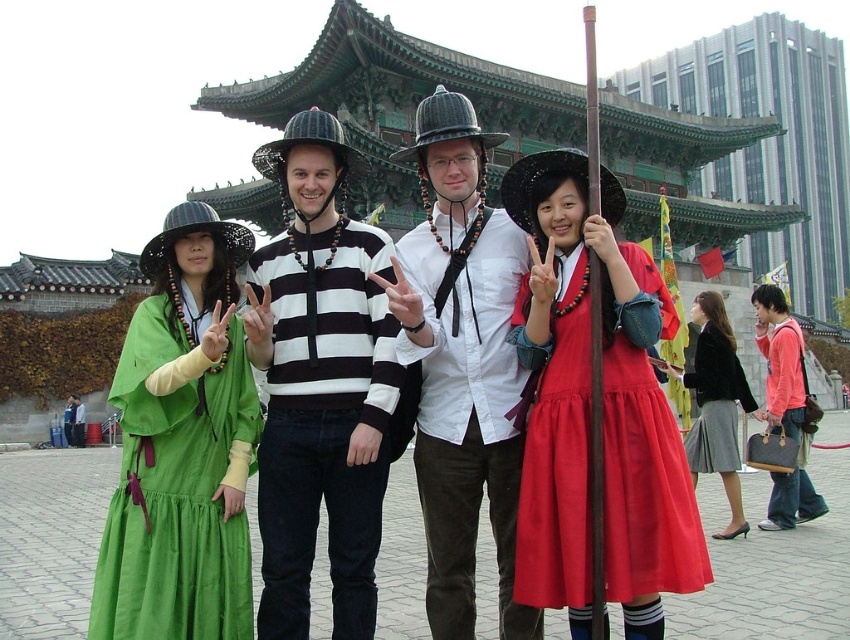
Question: Does gray pleated skirt at lower right appear on the right side of matte black dress at center?

Choices:
 (A) no
 (B) yes

Answer: (A)

Question: Which is nearer to the white striped sweater at center?

Choices:
 (A) green cotton dress at left
 (B) gray pleated skirt at lower right

Answer: (A)

Question: In this image, where is matte red dress at center located relative to gray pleated skirt at lower right?

Choices:
 (A) above
 (B) below

Answer: (A)

Question: Can you confirm if white striped sweater at center is positioned above matte black dress at center?

Choices:
 (A) yes
 (B) no

Answer: (A)

Question: Among these points, which one is farthest from the camera?

Choices:
 (A) (790, 390)
 (B) (633, 570)
 (C) (663, 364)
 (D) (238, 627)

Answer: (C)

Question: Which of the following is the farthest from the observer?

Choices:
 (A) pink fabric jacket at right
 (B) white striped sweater at center
 (C) matte red dress at center

Answer: (A)